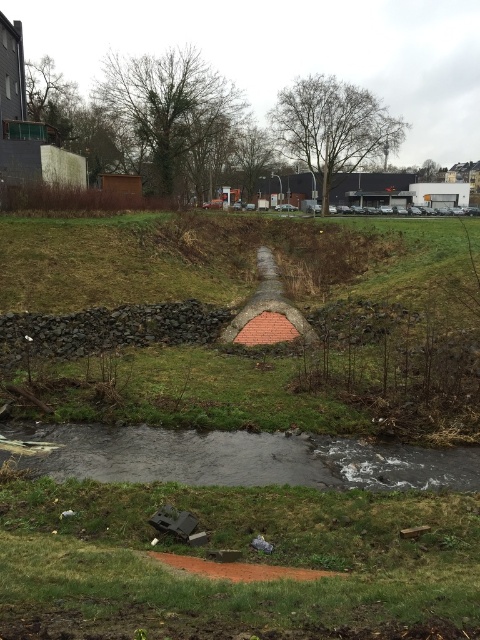
Question: Does green grass at center appear on the left side of gray smooth stream at lower center?

Choices:
 (A) no
 (B) yes

Answer: (B)

Question: Can you confirm if green grass at center is wider than green grass at lower center?

Choices:
 (A) no
 (B) yes

Answer: (B)

Question: Based on their relative distances, which object is farther from the green grass at center?

Choices:
 (A) gray smooth stream at lower center
 (B) green grass at lower center

Answer: (A)

Question: Which of the following is the farthest from the observer?

Choices:
 (A) gray smooth stream at lower center
 (B) green grass at center
 (C) green grass at lower center

Answer: (A)

Question: Is green grass at center bigger than green grass at lower center?

Choices:
 (A) no
 (B) yes

Answer: (B)

Question: Among these objects, which one is nearest to the camera?

Choices:
 (A) green grass at center
 (B) green grass at lower center
 (C) gray smooth stream at lower center

Answer: (B)